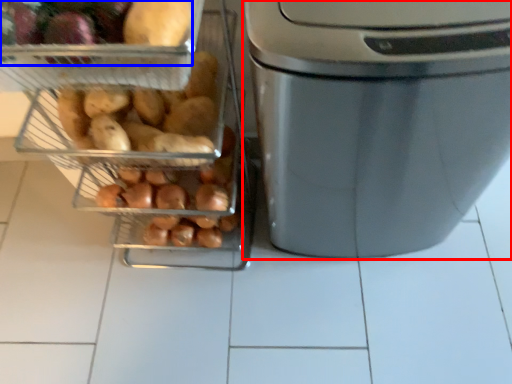
Question: Which point is further to the camera, home appliance (highlighted by a red box) or food (highlighted by a blue box)?

Choices:
 (A) home appliance
 (B) food

Answer: (B)